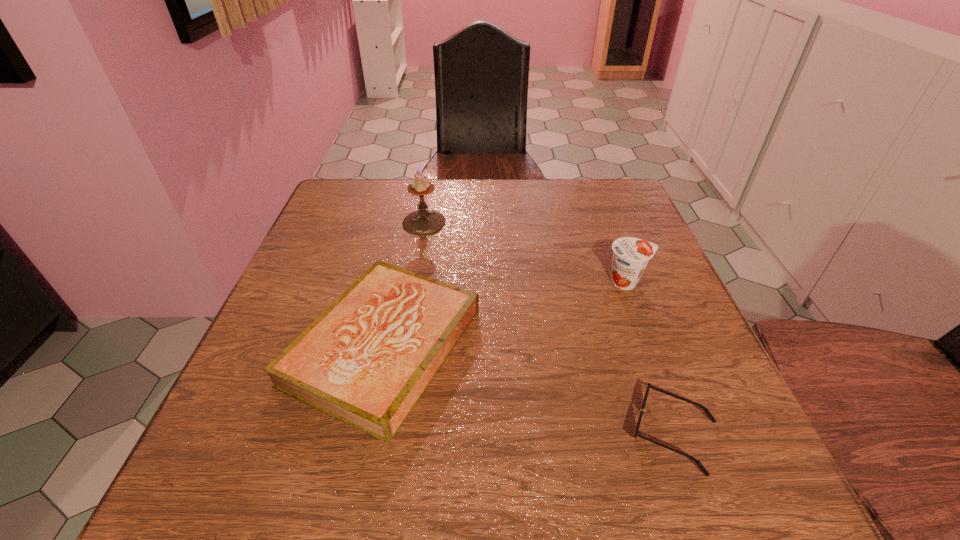
Find the location of a particular element. Image resolution: width=960 pixels, height=540 pixels. vacant space located 0.130m on the lenses of the sunglasses is located at coordinates (540, 433).

The height and width of the screenshot is (540, 960). In order to click on object that is at the far edge in this screenshot , I will do tap(422, 222).

What are the coordinates of `object that is at the near edge` in the screenshot? It's located at (649, 386).

Find the location of a particular element. This screenshot has height=540, width=960. object that is positioned at the left edge is located at coordinates (366, 360).

Find the location of a particular element. yogurt at the right edge is located at coordinates (630, 255).

Where is `sunglasses that is at the right edge`? sunglasses that is at the right edge is located at coordinates (649, 386).

Locate an element on the screen. Image resolution: width=960 pixels, height=540 pixels. object situated at the near right corner is located at coordinates (649, 386).

In the image, there is a desktop. At what (x,y) coordinates should I click in order to perform the action: click on free space at the far edge. Please return your answer as a coordinate pair (x, y). This screenshot has width=960, height=540. Looking at the image, I should click on (563, 185).

Where is `vacant space at the near edge`? vacant space at the near edge is located at coordinates (369, 503).

What are the coordinates of `vacant point at the left edge` in the screenshot? It's located at click(345, 234).